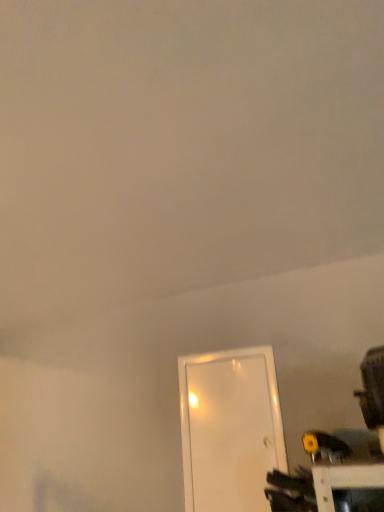
I want to click on white glossy door at center, so click(230, 429).

Image resolution: width=384 pixels, height=512 pixels. What do you see at coordinates (230, 429) in the screenshot? I see `white glossy door at center` at bounding box center [230, 429].

Where is `white glossy door at center`? This screenshot has width=384, height=512. white glossy door at center is located at coordinates (230, 429).